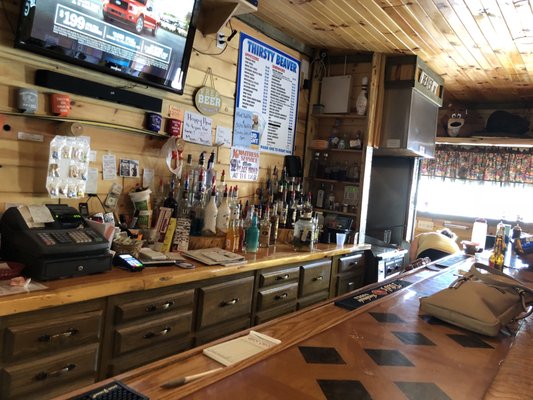
The height and width of the screenshot is (400, 533). I want to click on soundbar, so click(133, 104).